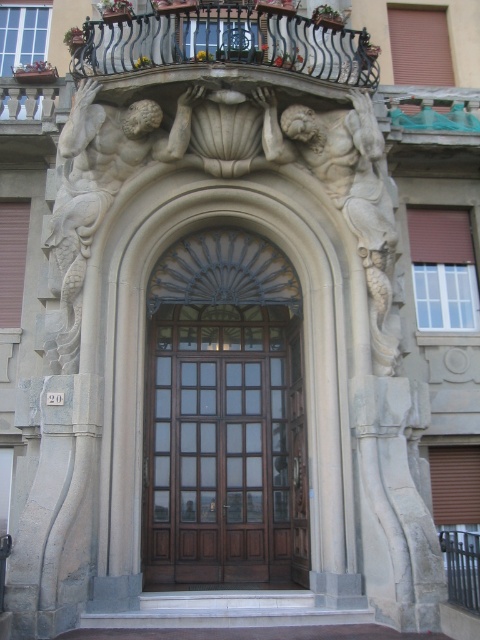
Who is lower down, mahogany wood door at center or polished metal balustrade at center?

polished metal balustrade at center is lower down.

Can you confirm if mahogany wood door at center is shorter than polished metal balustrade at center?

No.

Does point (159, 356) come closer to viewer compared to point (464, 582)?

No.

Where is `mahogany wood door at center`? This screenshot has width=480, height=640. mahogany wood door at center is located at coordinates (226, 448).

Between black wrought iron balcony at upper center and polished metal balustrade at center, which one is positioned higher?

black wrought iron balcony at upper center is above.

Is black wrought iron balcony at upper center positioned in front of polished metal balustrade at center?

No, black wrought iron balcony at upper center is behind polished metal balustrade at center.

The width and height of the screenshot is (480, 640). Identify the location of black wrought iron balcony at upper center. (228, 45).

Does mahogany wood door at center have a lesser height compared to black wrought iron balcony at upper center?

Incorrect, mahogany wood door at center's height does not fall short of black wrought iron balcony at upper center's.

Between point (210, 390) and point (320, 26), which one is positioned in front?

Point (320, 26)

Describe the element at coordinates (226, 448) in the screenshot. I see `mahogany wood door at center` at that location.

At what (x,y) coordinates should I click in order to perform the action: click on mahogany wood door at center. Please return your answer as a coordinate pair (x, y). The width and height of the screenshot is (480, 640). Looking at the image, I should click on (226, 448).